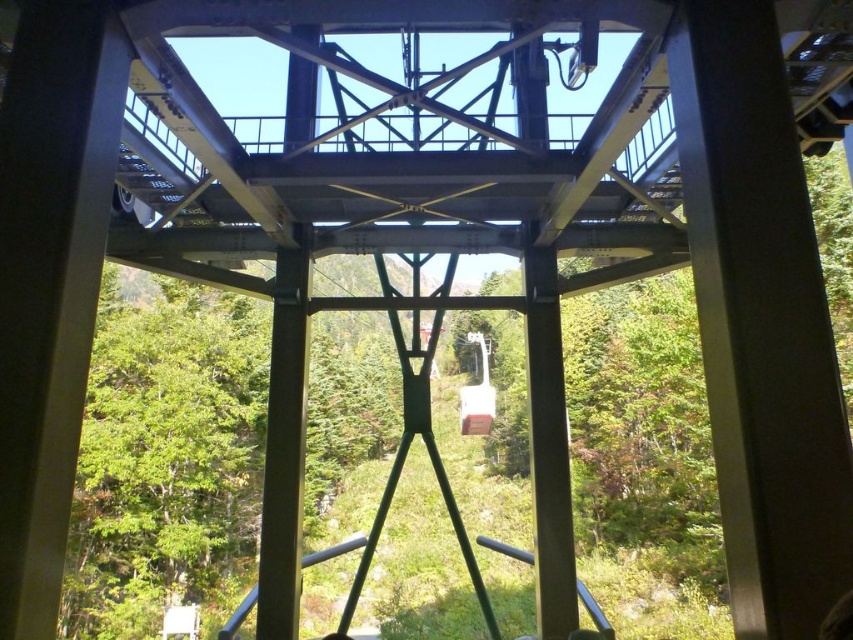
Is green matte tree at center wider than metallic cable car at center?

Yes.

Find the location of `green matte tree at center`. green matte tree at center is located at coordinates (166, 458).

Between point (212, 403) and point (463, 400), which one is positioned behind?

Point (463, 400)

Locate an element on the screen. The image size is (853, 640). green matte tree at center is located at coordinates (166, 458).